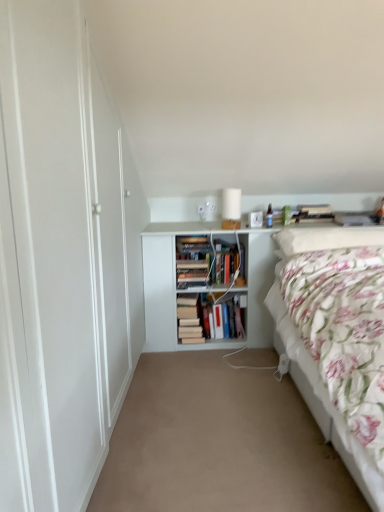
Describe the element at coordinates (163, 282) in the screenshot. I see `white matte bookshelf at center` at that location.

Find the location of a particular element. This screenshot has height=512, width=384. hardcover books at center, the first book viewed from the left is located at coordinates 189,319.

Locate an element on the screen. This screenshot has height=512, width=384. floral cotton bed at right is located at coordinates (338, 331).

Describe the element at coordinates (231, 208) in the screenshot. I see `white glossy table lamp at center` at that location.

Identify the location of white matte bookshelf at center. (163, 282).

Is point (210, 325) closer to camera compared to point (327, 230)?

No, it is not.

Is fluffy white pillow at upper right completely or partially inside hardcover book at center, the first book positioned from the right?

That's incorrect, fluffy white pillow at upper right is not inside hardcover book at center, the first book positioned from the right.

Which object is further away from the camera, hardcover book at center, arranged as the 2th book when viewed from the left, or fluffy white pillow at upper right?

hardcover book at center, arranged as the 2th book when viewed from the left, is behind.

How distant is hardcover book at center, arranged as the 2th book when viewed from the left, from fluffy white pillow at upper right?

The distance of hardcover book at center, arranged as the 2th book when viewed from the left, from fluffy white pillow at upper right is 30.44 inches.

Based on the photo, considering the relative positions of fluffy white pillow at upper right and hardcover book at center, the first book positioned from the right, in the image provided, is fluffy white pillow at upper right in front of hardcover book at center, the first book positioned from the right,?

Yes, fluffy white pillow at upper right is closer to the viewer.

Considering the relative sizes of fluffy white pillow at upper right and hardcover book at center, arranged as the 2th book when viewed from the left, in the image provided, is fluffy white pillow at upper right wider than hardcover book at center, arranged as the 2th book when viewed from the left,?

Yes.

In the scene shown: From a real-world perspective, who is located higher, fluffy white pillow at upper right or hardcover book at center, the first book positioned from the right?

In real-world perspective, fluffy white pillow at upper right is above.

Is point (157, 269) closer or farther from the camera than point (251, 489)?

Point (157, 269) is positioned farther from the camera compared to point (251, 489).

Is white matte bookshelf at center located outside beige carpet at center?

Yes, white matte bookshelf at center is not within beige carpet at center.

Is hardcover books at center, the 2th book viewed from the right, taller than hardcover book at center, the first book positioned from the right?

Yes.

Which is in front, point (188, 336) or point (217, 306)?

The point (188, 336) is more forward.

Is hardcover books at center, the 2th book viewed from the right, not inside hardcover book at center, arranged as the 2th book when viewed from the left?

Absolutely, hardcover books at center, the 2th book viewed from the right, is external to hardcover book at center, arranged as the 2th book when viewed from the left.

Based on the photo, could white glossy table lamp at center be considered to be inside white matte bookshelf at center?

No.

Could you tell me if white matte bookshelf at center is facing white glossy table lamp at center?

No, white matte bookshelf at center is not facing towards white glossy table lamp at center.

Looking at this image, would you say white matte bookshelf at center is to the left or to the right of white glossy table lamp at center in the picture?

Based on their positions, white matte bookshelf at center is located to the right of white glossy table lamp at center.

Which object is further away from the camera, white matte bookshelf at center or white glossy table lamp at center?

white glossy table lamp at center.

Considering the sizes of objects beige carpet at center and fluffy white pillow at upper right in the image provided, who is wider, beige carpet at center or fluffy white pillow at upper right?

beige carpet at center is wider.

Does beige carpet at center lie behind fluffy white pillow at upper right?

No, it is in front of fluffy white pillow at upper right.

Is beige carpet at center not inside fluffy white pillow at upper right?

Yes, beige carpet at center is located beyond the bounds of fluffy white pillow at upper right.

Locate an element on the screen. This screenshot has width=384, height=512. plain below the fluffy white pillow at upper right (from a real-world perspective) is located at coordinates (218, 443).

Is white matte bookshelf at center aimed at hardcover book at center, the first book positioned from the right?

Yes, white matte bookshelf at center faces towards hardcover book at center, the first book positioned from the right.

Which of these two, white matte bookshelf at center or hardcover book at center, arranged as the 2th book when viewed from the left, is thinner?

hardcover book at center, arranged as the 2th book when viewed from the left, is thinner.

Between white matte bookshelf at center and hardcover book at center, the first book positioned from the right, which one is positioned behind?

hardcover book at center, the first book positioned from the right, is behind.

From the picture: Can you tell me how much white matte bookshelf at center and hardcover book at center, the first book positioned from the right, differ in facing direction?

white matte bookshelf at center and hardcover book at center, the first book positioned from the right, are facing 0.000884 degrees away from each other.

Where is `pillow that is on the right side of hardcover book at center, arranged as the 2th book when viewed from the left`? The image size is (384, 512). pillow that is on the right side of hardcover book at center, arranged as the 2th book when viewed from the left is located at coordinates (327, 238).

Locate an element on the screen. pillow that is above the hardcover book at center, arranged as the 2th book when viewed from the left (from a real-world perspective) is located at coordinates (327, 238).

Which object lies further to the anchor point beige carpet at center, white glossy table lamp at center or hardcover books at center, the 2th book viewed from the right?

Based on the image, white glossy table lamp at center appears to be further to beige carpet at center.

Which object lies nearer to the anchor point fluffy white pillow at upper right, beige carpet at center or hardcover books at center, the 2th book viewed from the right?

Among the two, hardcover books at center, the 2th book viewed from the right, is located nearer to fluffy white pillow at upper right.

From the picture: Looking at the image, which one is located further to hardcover book at center, arranged as the 2th book when viewed from the left, hardcover books at center, the 2th book viewed from the right, or fluffy white pillow at upper right?

Among the two, fluffy white pillow at upper right is located further to hardcover book at center, arranged as the 2th book when viewed from the left.

Estimate the real-world distances between objects in this image. Which object is further from floral cotton bed at right, white glossy table lamp at center or hardcover books at center, the 2th book viewed from the right?

hardcover books at center, the 2th book viewed from the right.

Estimate the real-world distances between objects in this image. Which object is closer to white matte bookshelf at center, white glossy table lamp at center or hardcover book at center, arranged as the 2th book when viewed from the left?

Among the two, hardcover book at center, arranged as the 2th book when viewed from the left, is located nearer to white matte bookshelf at center.

Looking at the image, which one is located closer to floral cotton bed at right, white matte bookshelf at center or white glossy table lamp at center?

white glossy table lamp at center.

Looking at this image, based on their spatial positions, is white matte bookshelf at center or white glossy table lamp at center further from hardcover book at center, arranged as the 2th book when viewed from the left?

white glossy table lamp at center.

From the image, which object appears to be nearer to floral cotton bed at right, beige carpet at center or white glossy table lamp at center?

beige carpet at center is positioned closer to the anchor floral cotton bed at right.

Identify the location of table lamp between beige carpet at center and hardcover books at center, the first book viewed from the left, in the front-back direction. (231, 208).

Locate an element on the screen. shelf situated between hardcover book at center, the first book positioned from the right, and fluffy white pillow at upper right from left to right is located at coordinates (163, 282).

Where is `shelf situated between hardcover books at center, the first book viewed from the left, and fluffy white pillow at upper right from left to right`? shelf situated between hardcover books at center, the first book viewed from the left, and fluffy white pillow at upper right from left to right is located at coordinates (163, 282).

Find the location of a particular element. Image resolution: width=384 pixels, height=512 pixels. plain positioned between floral cotton bed at right and white matte bookshelf at center from near to far is located at coordinates (218, 443).